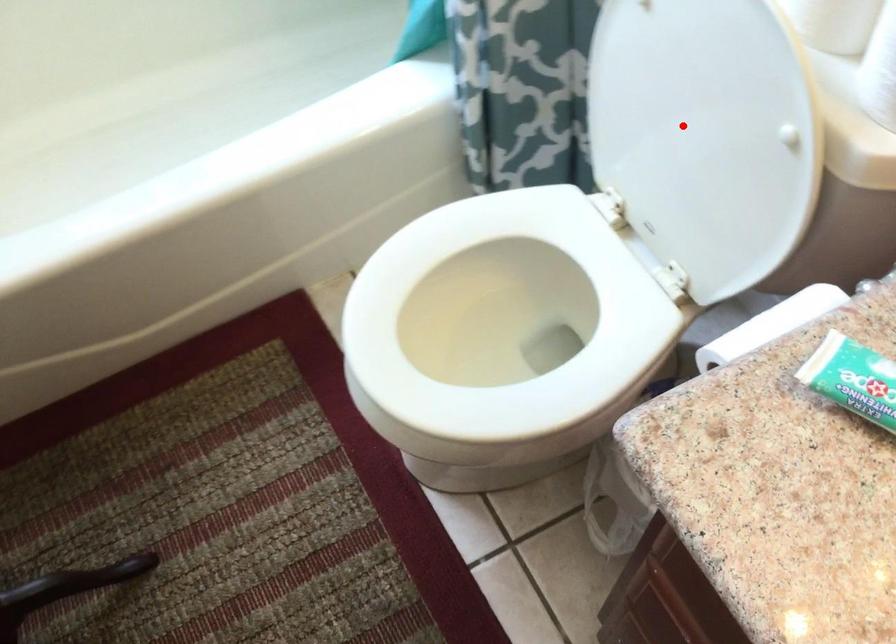
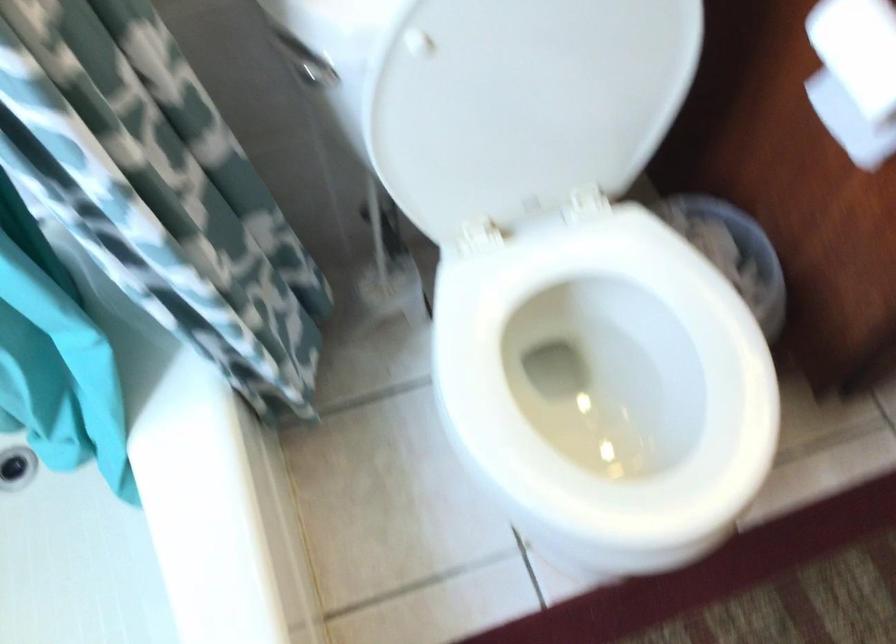
Find the pixel in the second image that matches the highlighted location in the first image.

(528, 93)